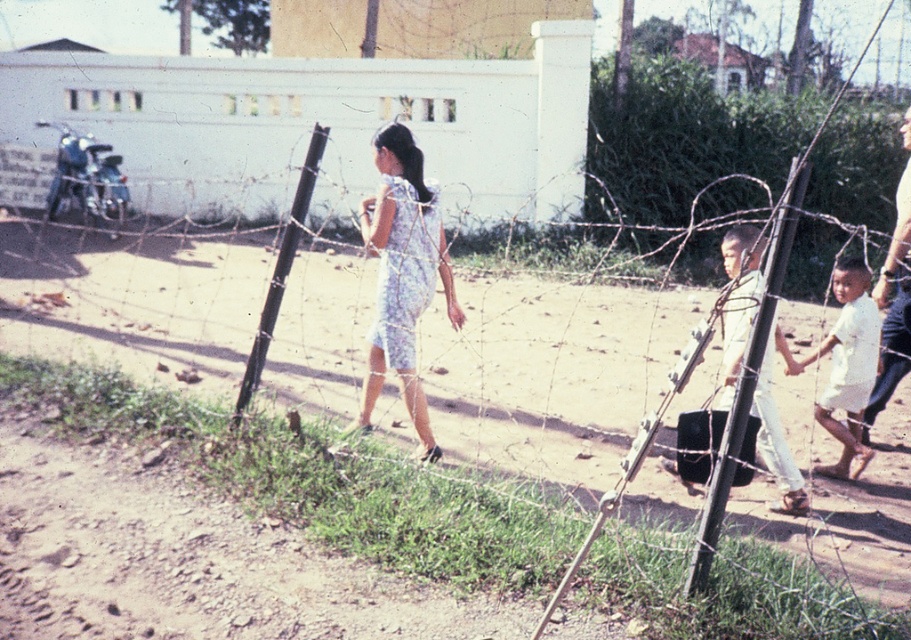
Does point (758, 291) come farther from viewer compared to point (863, 419)?

No, (758, 291) is in front of (863, 419).

Does light beige pants at center appear over light blue dress at right?

No, light beige pants at center is not above light blue dress at right.

Who is more distant from viewer, (740, 320) or (862, 417)?

The point (862, 417) is behind.

Locate an element on the screen. The image size is (911, 640). light beige pants at center is located at coordinates (738, 301).

Is white cotton shirt at center-right to the left of light blue dress at right from the viewer's perspective?

Correct, you'll find white cotton shirt at center-right to the left of light blue dress at right.

From the picture: Can you confirm if white cotton shirt at center-right is positioned above light blue dress at right?

Incorrect, white cotton shirt at center-right is not positioned above light blue dress at right.

Does point (824, 419) lie behind point (894, 310)?

That is False.

Find the location of `white cotton shirt at center-right`. white cotton shirt at center-right is located at coordinates (848, 365).

Does point (396, 136) come behind point (785, 368)?

No, it is in front of (785, 368).

Is white floral dress at center below light beige pants at center?

No.

This screenshot has width=911, height=640. Find the location of `white floral dress at center`. white floral dress at center is located at coordinates (402, 275).